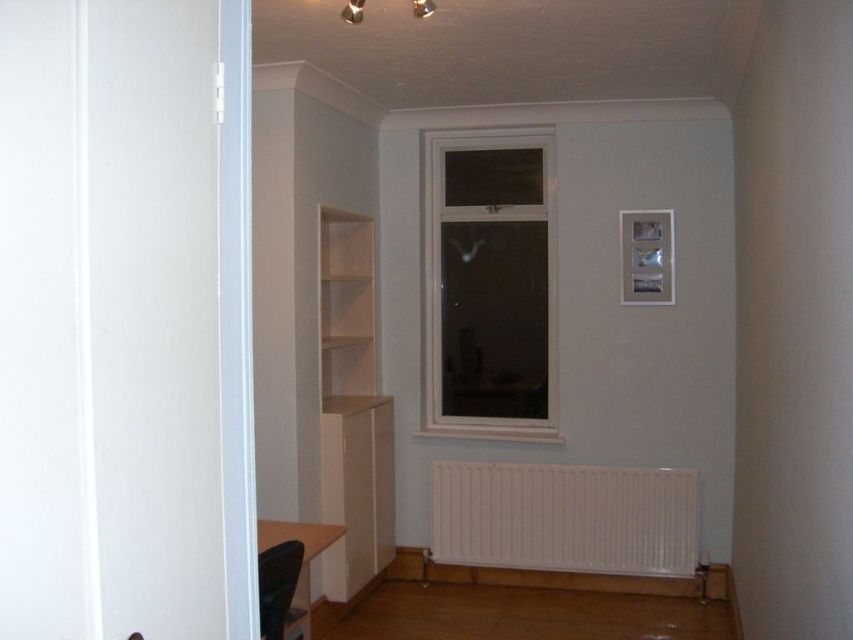
You are standing in the doorway of the room and want to place a new painting on the wall between the white matte radiator at lower center and the white matte bookshelf at left. Which object is closer to you, making it easier to reach?

The white matte radiator at lower center is closer to you, so it is easier to reach than the white matte bookshelf at left.

You are moving a small potted plant that is 30 cm tall. You want to place it on the light wood shelf at upper center. Can the white plastic window at center block sunlight from reaching the plant if placed there?

The white plastic window at center is positioned over the light wood shelf at upper center, so placing the plant on the shelf would place it directly under the window. Since the window is partially open and allows some light through, sunlight could still reach the plant, but the window frame might cast a shadow. However, the exact obstruction depends on the window position and time of day, which aren

You are standing in the doorway of the room and want to place a small plant on the closest object to the window. Which object should you choose between the white plastic window at center and the light wood shelf at upper center?

The light wood shelf at upper center is closer to the white plastic window at center because the window is to the right of the shelf. Therefore, you should place the plant on the light wood shelf at upper center.